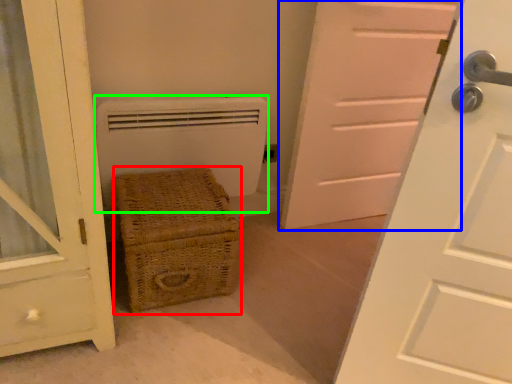
Question: Which object is the farthest from furniture (highlighted by a red box)? Choose among these: door (highlighted by a blue box) or heater (highlighted by a green box).

Choices:
 (A) door
 (B) heater

Answer: (A)